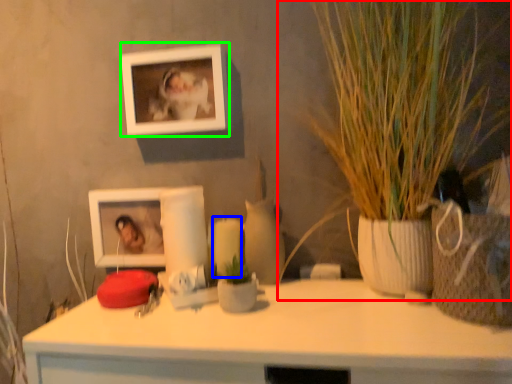
Question: Which is farther away from houseplant (highlighted by a red box)? candle (highlighted by a blue box) or picture frame (highlighted by a green box)?

Choices:
 (A) candle
 (B) picture frame

Answer: (A)